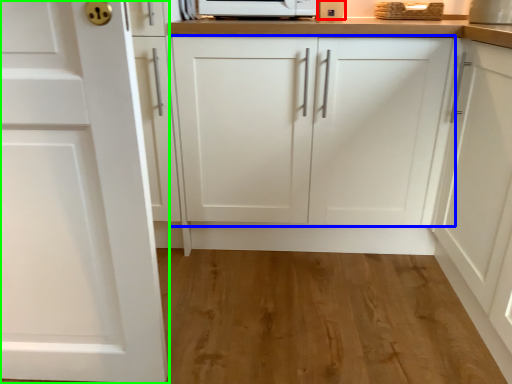
Question: Based on their relative distances, which object is nearer to appliance (highlighted by a red box)? Choose from cabinetry (highlighted by a blue box) and cabinetry (highlighted by a green box).

Choices:
 (A) cabinetry
 (B) cabinetry

Answer: (A)